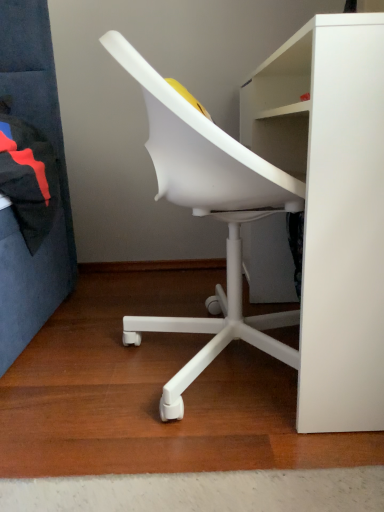
Question: Is white plastic chair at center situated inside white matte desk at center or outside?

Choices:
 (A) inside
 (B) outside

Answer: (A)

Question: Is white plastic chair at center to the left or to the right of white matte desk at center in the image?

Choices:
 (A) left
 (B) right

Answer: (A)

Question: Relative to white matte desk at center, is white plastic chair at center in front or behind?

Choices:
 (A) front
 (B) behind

Answer: (B)

Question: From a real-world perspective, is white matte desk at center physically located above or below white plastic chair at center?

Choices:
 (A) above
 (B) below

Answer: (B)

Question: From the image's perspective, is white matte desk at center positioned above or below white plastic chair at center?

Choices:
 (A) above
 (B) below

Answer: (A)

Question: Is white matte desk at center taller or shorter than white plastic chair at center?

Choices:
 (A) tall
 (B) short

Answer: (B)

Question: Looking at the image, does white matte desk at center seem bigger or smaller compared to white plastic chair at center?

Choices:
 (A) small
 (B) big

Answer: (B)